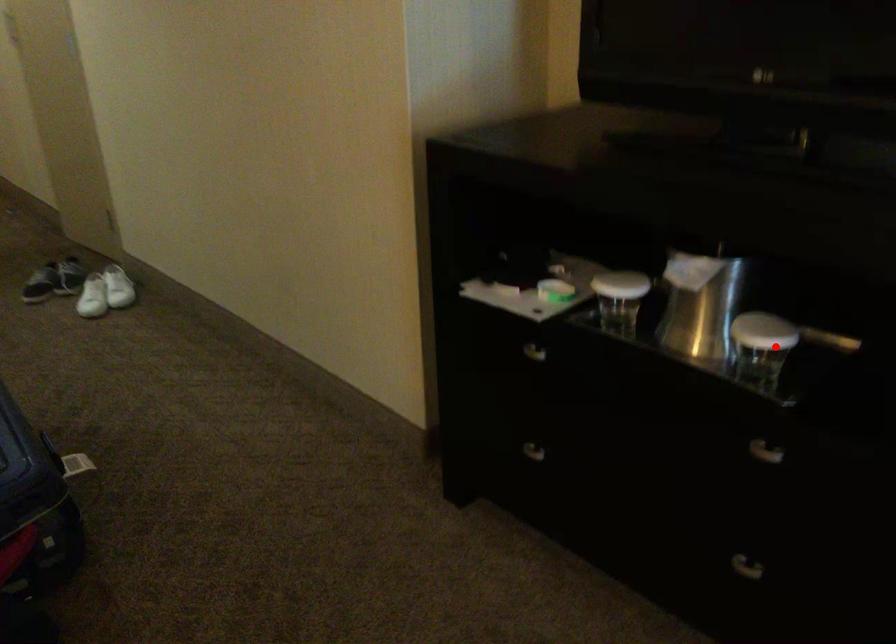
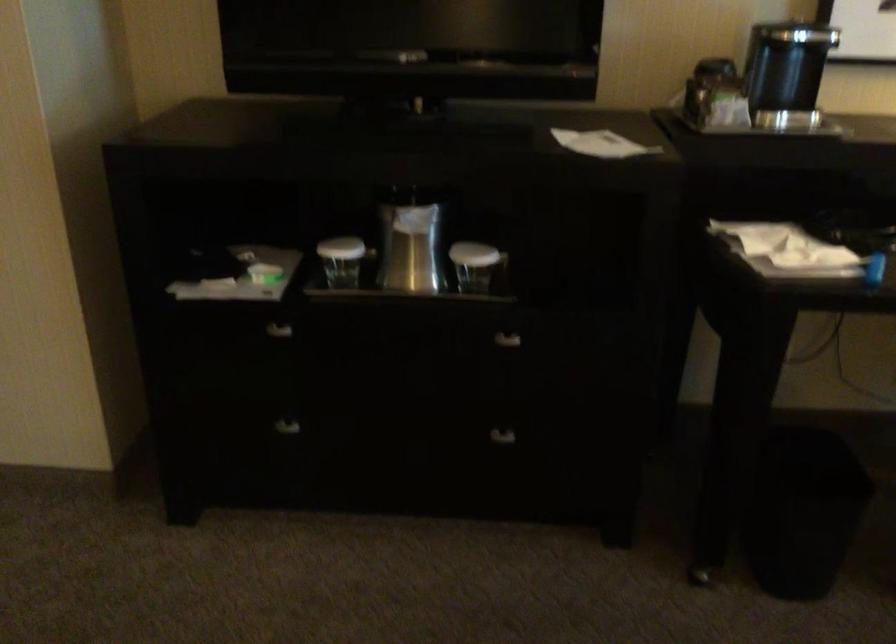
Question: A red point is marked in image1. In image2, is the corresponding 3D point closer to the camera or farther? Reply with the corresponding letter.

Choices:
 (A) The corresponding 3D point is closer.
 (B) The corresponding 3D point is farther.

Answer: (B)